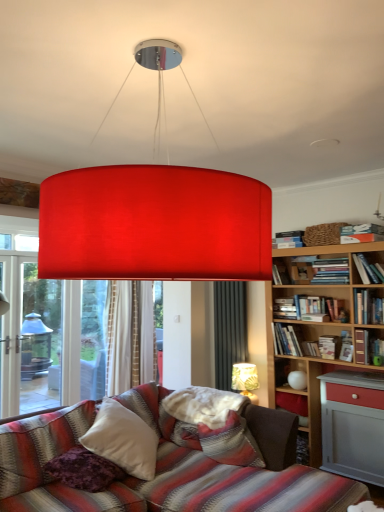
Question: Does hardcover book at upper right, the 8th book ordered from the bottom, have a larger size compared to white soft pillow at center, the second pillow in the left-to-right sequence?

Choices:
 (A) no
 (B) yes

Answer: (A)

Question: Are hardcover book at upper right, placed as the second book when sorted from top to bottom, and white soft pillow at center, the second pillow in the left-to-right sequence, making contact?

Choices:
 (A) yes
 (B) no

Answer: (B)

Question: Is hardcover book at upper right, the 8th book ordered from the bottom, to the left of white soft pillow at center, which is the 1th pillow from right to left, from the viewer's perspective?

Choices:
 (A) yes
 (B) no

Answer: (B)

Question: Is hardcover book at upper right, the 8th book ordered from the bottom, aimed at white soft pillow at center, the second pillow in the left-to-right sequence?

Choices:
 (A) no
 (B) yes

Answer: (A)

Question: Can you confirm if hardcover book at upper right, placed as the second book when sorted from top to bottom, is wider than white soft pillow at center, the second pillow in the left-to-right sequence?

Choices:
 (A) no
 (B) yes

Answer: (A)

Question: Considering the positions of hardcover book at upper right, positioned as the fourth book in bottom-to-top order, and white soft pillow at center, which is the 1th pillow from right to left, in the image, is hardcover book at upper right, positioned as the fourth book in bottom-to-top order, taller or shorter than white soft pillow at center, which is the 1th pillow from right to left,?

Choices:
 (A) short
 (B) tall

Answer: (A)

Question: In terms of width, does hardcover book at upper right, which is counted as the sixth book, starting from the top, look wider or thinner when compared to white soft pillow at center, the second pillow in the left-to-right sequence?

Choices:
 (A) wide
 (B) thin

Answer: (B)

Question: Considering the positions of hardcover book at upper right, which is counted as the sixth book, starting from the top, and white soft pillow at center, which is the 1th pillow from right to left, in the image, is hardcover book at upper right, which is counted as the sixth book, starting from the top, bigger or smaller than white soft pillow at center, which is the 1th pillow from right to left,?

Choices:
 (A) big
 (B) small

Answer: (B)

Question: In the image, is hardcover book at upper right, positioned as the fourth book in bottom-to-top order, positioned in front of or behind white soft pillow at center, which is the 1th pillow from right to left?

Choices:
 (A) behind
 (B) front

Answer: (A)

Question: Considering the positions of hardcover books at upper right, which is counted as the seventh book, starting from the bottom, and matte gold lampshade at lower right, the second lamp viewed from the front, in the image, is hardcover books at upper right, which is counted as the seventh book, starting from the bottom, taller or shorter than matte gold lampshade at lower right, the second lamp viewed from the front,?

Choices:
 (A) tall
 (B) short

Answer: (B)

Question: Which is correct: hardcover books at upper right, which is counted as the seventh book, starting from the bottom, is inside matte gold lampshade at lower right, the 1th lamp positioned from the back, or outside of it?

Choices:
 (A) outside
 (B) inside

Answer: (A)

Question: Is hardcover books at upper right, which is counted as the seventh book, starting from the bottom, to the left or to the right of matte gold lampshade at lower right, placed as the 1th lamp when sorted from bottom to top, in the image?

Choices:
 (A) right
 (B) left

Answer: (A)

Question: Looking at the image, does hardcover books at upper right, positioned as the third book in top-to-bottom order, seem bigger or smaller compared to matte gold lampshade at lower right, the 2th lamp positioned from the left?

Choices:
 (A) small
 (B) big

Answer: (A)

Question: Is hardcover book at upper right, marked as the fifth book in a top-to-bottom arrangement, taller or shorter than hardcover book at upper right, positioned as the ninth book in top-to-bottom order?

Choices:
 (A) short
 (B) tall

Answer: (B)

Question: From a real-world perspective, is hardcover book at upper right, marked as the fifth book in a top-to-bottom arrangement, positioned above or below hardcover book at upper right, which is counted as the 1th book, starting from the bottom?

Choices:
 (A) above
 (B) below

Answer: (A)